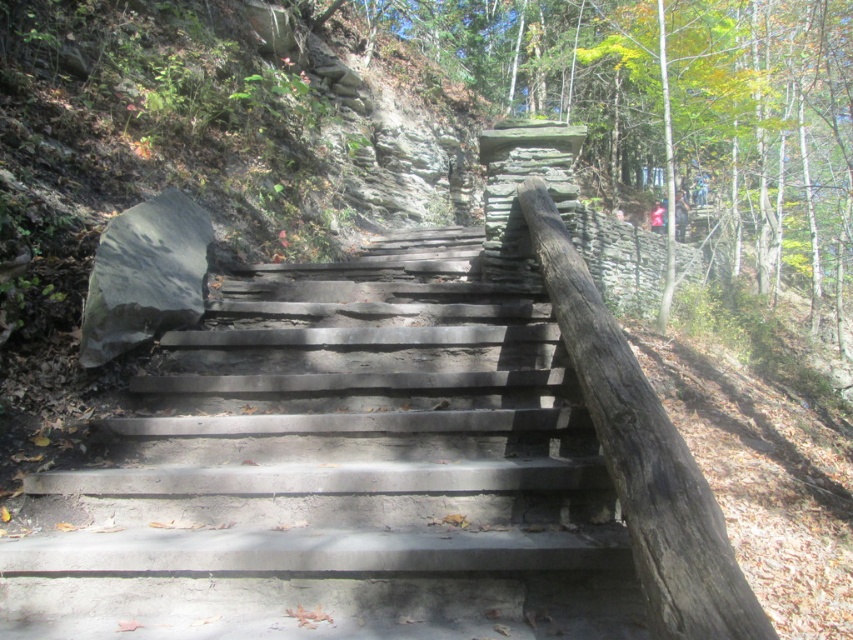
You are carrying a 50 cm wide box and need to place it between the gray concrete stairs at center and the smooth brown log at right. Can the box fit in the space between them?

The gray concrete stairs at center and smooth brown log at right are 51.66 centimeters apart, so the 50 cm wide box can fit between them as there is enough space.

You are carrying a large backpack and need to walk up the gray concrete stairs at center and the smooth brown log at right. Which path has a wider surface to place your feet comfortably?

The gray concrete stairs at center has a larger width than the smooth brown log at right, so the gray concrete stairs at center provides a wider surface for comfortable footing.